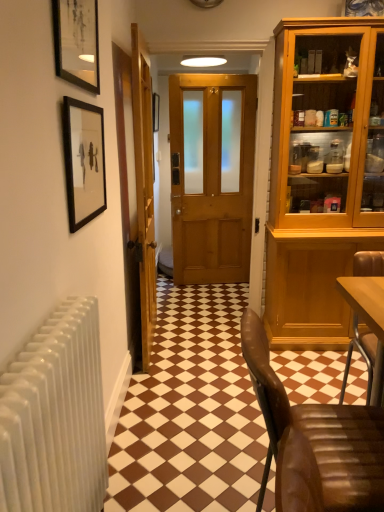
Question: Should I look upward or downward to see wooden door at center, marked as the 2th door in a right-to-left arrangement?

Choices:
 (A) down
 (B) up

Answer: (B)

Question: Is wooden door at center, marked as the 2th door in a right-to-left arrangement, aimed at black matte picture frame at upper left, which appears as the 1th picture frame when ordered from the bottom?

Choices:
 (A) yes
 (B) no

Answer: (B)

Question: Is wooden door at center, positioned as the first door in left-to-right order, bigger than black matte picture frame at upper left, positioned as the 2th picture frame in front-to-back order?

Choices:
 (A) yes
 (B) no

Answer: (A)

Question: Is wooden door at center, positioned as the first door in left-to-right order, positioned before black matte picture frame at upper left, which is the 2th picture frame in back-to-front order?

Choices:
 (A) no
 (B) yes

Answer: (A)

Question: Is wooden door at center, marked as the 2th door in a right-to-left arrangement, not close to black matte picture frame at upper left, positioned as the 2th picture frame in front-to-back order?

Choices:
 (A) no
 (B) yes

Answer: (A)

Question: Is wooden door at center, marked as the 2th door in a right-to-left arrangement, outside black matte picture frame at upper left, which is the 2th picture frame in back-to-front order?

Choices:
 (A) no
 (B) yes

Answer: (B)

Question: From a real-world perspective, is wooden door at center, marked as the 2th door in a right-to-left arrangement, below black matte picture frame at upper left, which is the 2th picture frame in back-to-front order?

Choices:
 (A) yes
 (B) no

Answer: (A)

Question: From the image's perspective, is wooden door at center, marked as the 2th door in a right-to-left arrangement, on top of matte black picture frame at center, positioned as the 1th picture frame in top-to-bottom order?

Choices:
 (A) no
 (B) yes

Answer: (A)

Question: Is there a large distance between wooden door at center, marked as the 2th door in a right-to-left arrangement, and matte black picture frame at center, arranged as the 3th picture frame when viewed from the front?

Choices:
 (A) yes
 (B) no

Answer: (A)

Question: Considering the relative sizes of wooden door at center, positioned as the first door in left-to-right order, and matte black picture frame at center, arranged as the 3th picture frame when viewed from the front, in the image provided, is wooden door at center, positioned as the first door in left-to-right order, thinner than matte black picture frame at center, arranged as the 3th picture frame when viewed from the front,?

Choices:
 (A) yes
 (B) no

Answer: (B)

Question: Is wooden door at center, positioned as the first door in left-to-right order, positioned with its back to matte black picture frame at center, positioned as the 1th picture frame in top-to-bottom order?

Choices:
 (A) no
 (B) yes

Answer: (A)

Question: Is matte black picture frame at center, marked as the 1th picture frame in a back-to-front arrangement, a part of wooden door at center, marked as the 2th door in a right-to-left arrangement?

Choices:
 (A) no
 (B) yes

Answer: (A)

Question: Does wooden door at center, marked as the 2th door in a right-to-left arrangement, have a larger size compared to matte black picture frame at center, the third picture frame positioned from the bottom?

Choices:
 (A) no
 (B) yes

Answer: (B)

Question: Is brown leather chair at lower right to the right of wooden door at center, positioned as the 2th door in left-to-right order, from the viewer's perspective?

Choices:
 (A) no
 (B) yes

Answer: (B)